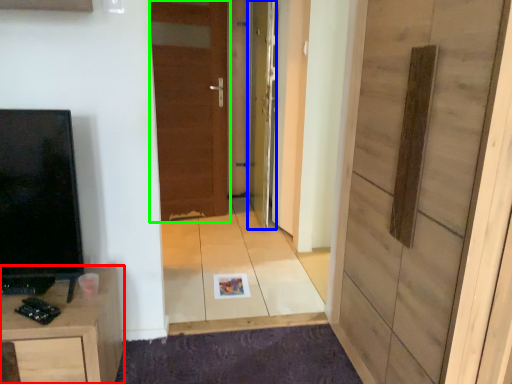
Question: Considering the real-world distances, which object is farthest from cabinetry (highlighted by a red box)? door (highlighted by a blue box) or door (highlighted by a green box)?

Choices:
 (A) door
 (B) door

Answer: (B)